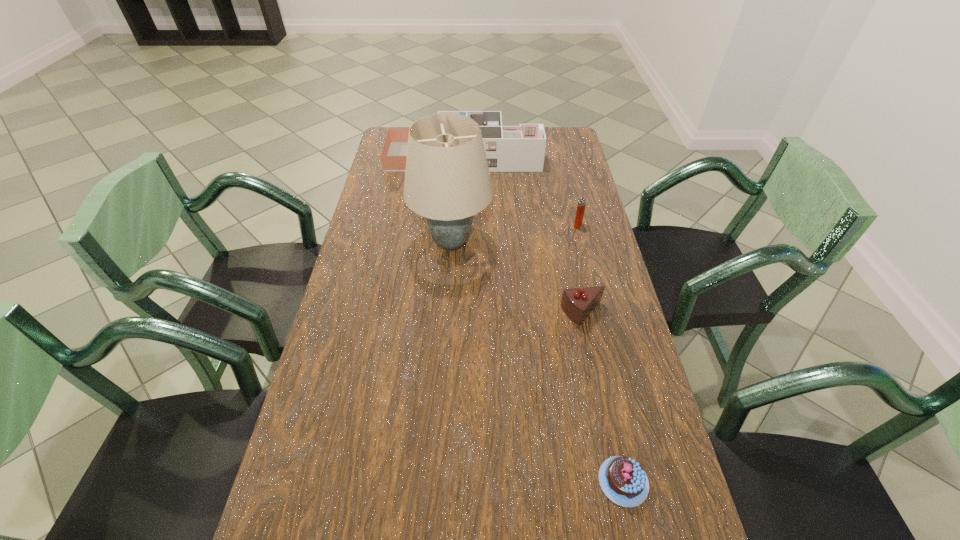
The image size is (960, 540). I want to click on object that ranks as the closest to the dollhouse, so click(447, 180).

Where is `vacant space that satisfies the following two spatial constraints: 1. at the front door of the dollhouse; 2. on the left side of the fourth tallest object`? The width and height of the screenshot is (960, 540). vacant space that satisfies the following two spatial constraints: 1. at the front door of the dollhouse; 2. on the left side of the fourth tallest object is located at coordinates (456, 313).

The width and height of the screenshot is (960, 540). Identify the location of vacant position in the image that satisfies the following two spatial constraints: 1. on the back side of the shorter chocolate cake; 2. at the front door of the farthest object. [553, 157].

Where is `free spot that satisfies the following two spatial constraints: 1. on the back side of the third tallest object; 2. at the front door of the farthest object`? free spot that satisfies the following two spatial constraints: 1. on the back side of the third tallest object; 2. at the front door of the farthest object is located at coordinates (562, 157).

You are a GUI agent. You are given a task and a screenshot of the screen. Output one action in this format:
    pyautogui.click(x=<x>, y=<y>)
    Task: Click on the vacant point that satisfies the following two spatial constraints: 1. on the back side of the third tallest object; 2. on the right side of the lampshade
    This screenshot has height=540, width=960.
    Given the screenshot: What is the action you would take?
    pyautogui.click(x=453, y=225)

Where is `free space that satisfies the following two spatial constraints: 1. on the back side of the third tallest object; 2. on the right side of the shortest object`? free space that satisfies the following two spatial constraints: 1. on the back side of the third tallest object; 2. on the right side of the shortest object is located at coordinates (567, 225).

The width and height of the screenshot is (960, 540). I want to click on free space that satisfies the following two spatial constraints: 1. at the front door of the second tallest object; 2. on the left side of the taller chocolate cake, so click(456, 313).

This screenshot has height=540, width=960. In order to click on vacant position in the image that satisfies the following two spatial constraints: 1. on the back side of the nearest object; 2. on the right side of the third shortest object in this screenshot , I will do click(x=567, y=225).